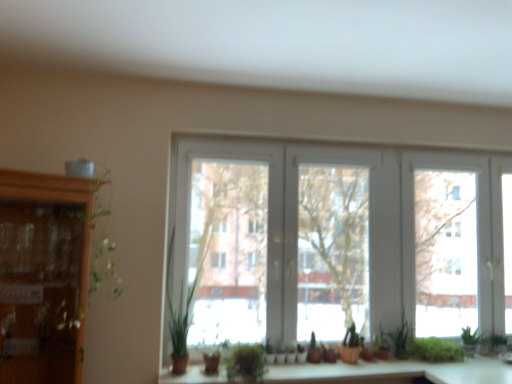
Question: From the image's perspective, is wooden cabinet at left above or below white plastic window at center?

Choices:
 (A) below
 (B) above

Answer: (A)

Question: Is wooden cabinet at left bigger or smaller than white plastic window at center?

Choices:
 (A) small
 (B) big

Answer: (A)

Question: Which is nearer to the green leafy plant at lower right, which appears as the sixth plant when viewed from the left?

Choices:
 (A) green matte plant at lower right, acting as the 4th plant starting from the left
 (B) green leafy plant at center, the first plant in the left-to-right sequence
 (C) green matte plant at lower right, marked as the second plant in a right-to-left arrangement
 (D) green matte plant at center
 (E) green matte plant at center, positioned as the third plant in left-to-right order

Answer: (C)

Question: Estimate the real-world distances between objects in this image. Which object is farther from the white plastic window at center?

Choices:
 (A) green leafy plant at lower right, which appears as the sixth plant when viewed from the left
 (B) green matte plant at lower right, which appears as the 3th plant when viewed from the right
 (C) green matte plant at center
 (D) green leafy plant at center, which ranks as the sixth plant in right-to-left order
 (E) matte wood counter top at center

Answer: (C)